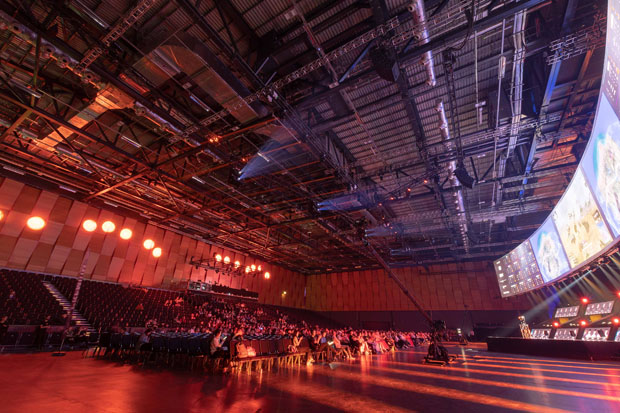
I want to click on floor, so click(329, 387).